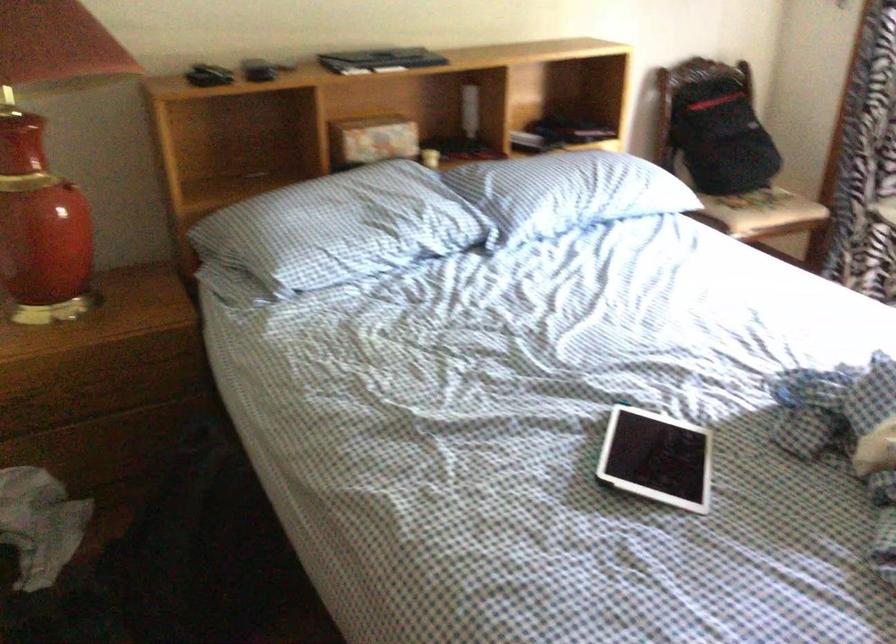
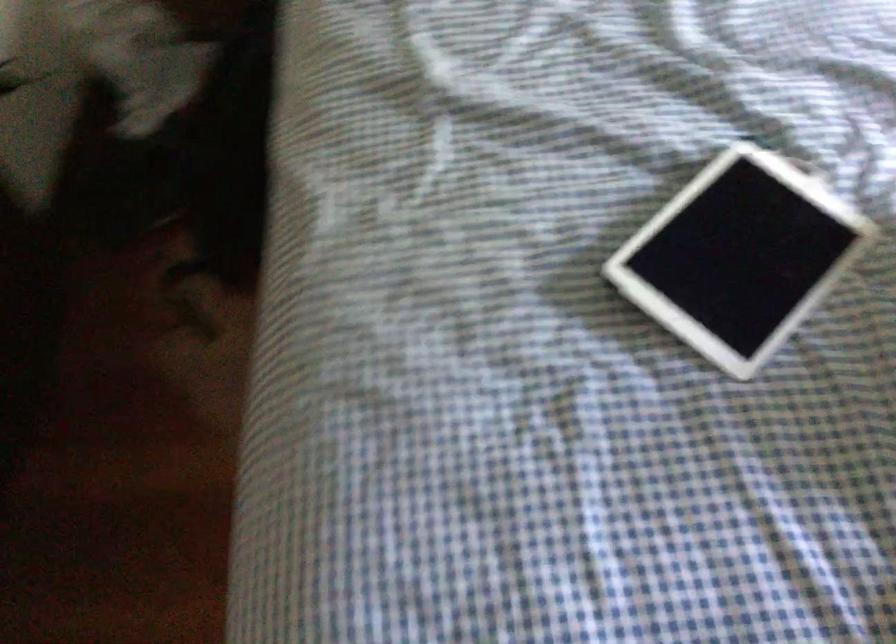
Based on the continuous images, in which direction is the camera rotating?

The camera's rotation is toward left-down.